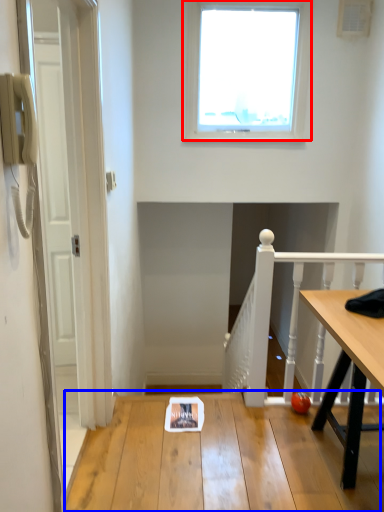
Question: Which of the following is the closest to the observer, window (highlighted by a red box) or table (highlighted by a blue box)?

Choices:
 (A) window
 (B) table

Answer: (B)